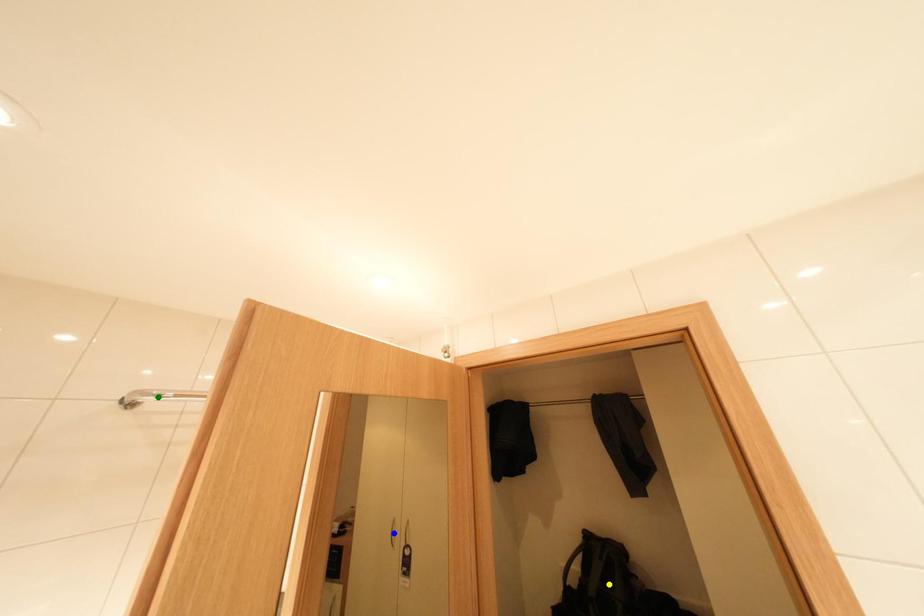
Order these from farthest to nearest:
A) blue point
B) yellow point
C) green point

1. blue point
2. yellow point
3. green point